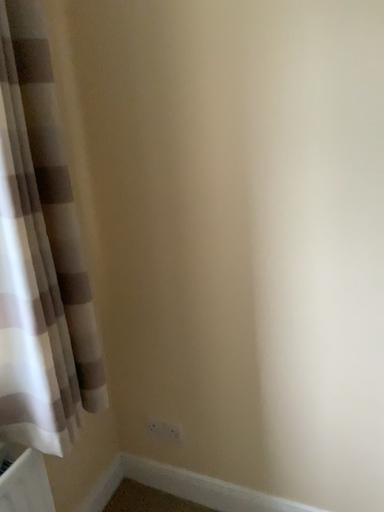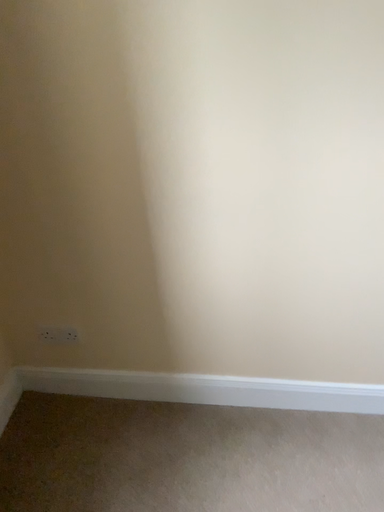
Question: Which way did the camera rotate in the video?

Choices:
 (A) rotated right
 (B) rotated left

Answer: (A)